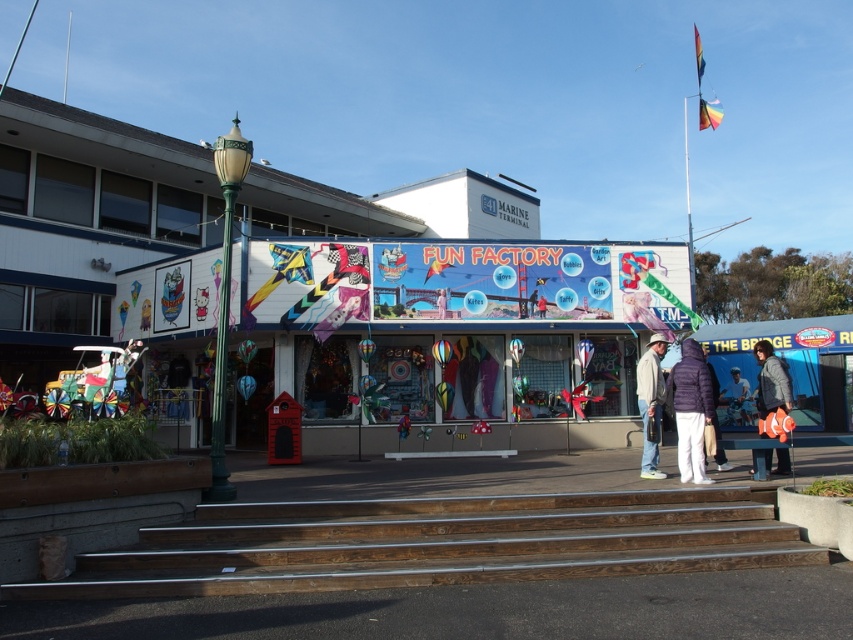
Is light brown leather jacket at center above white fabric person at center?

Indeed, light brown leather jacket at center is positioned over white fabric person at center.

Is light brown leather jacket at center to the left of white fabric person at center from the viewer's perspective?

Indeed, light brown leather jacket at center is positioned on the left side of white fabric person at center.

The width and height of the screenshot is (853, 640). What do you see at coordinates (650, 403) in the screenshot?
I see `light brown leather jacket at center` at bounding box center [650, 403].

Where is `light brown leather jacket at center`? light brown leather jacket at center is located at coordinates (650, 403).

Can you confirm if wooden stairs at center is positioned below purple fuzzy jacket at lower right?

Yes, wooden stairs at center is below purple fuzzy jacket at lower right.

Is wooden stairs at center bigger than purple fuzzy jacket at lower right?

Incorrect, wooden stairs at center is not larger than purple fuzzy jacket at lower right.

Who is more distant from viewer, (479, 512) or (717, 385)?

Point (717, 385)

Identify the location of wooden stairs at center. (434, 544).

Does wooden stairs at center appear on the right side of white fabric person at center?

Incorrect, wooden stairs at center is not on the right side of white fabric person at center.

Which of these two, wooden stairs at center or white fabric person at center, stands shorter?

wooden stairs at center is shorter.

The image size is (853, 640). In order to click on wooden stairs at center in this screenshot , I will do `click(434, 544)`.